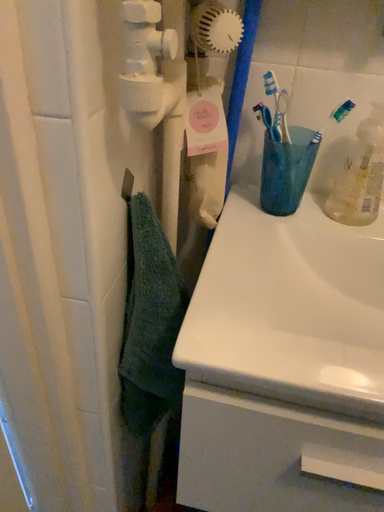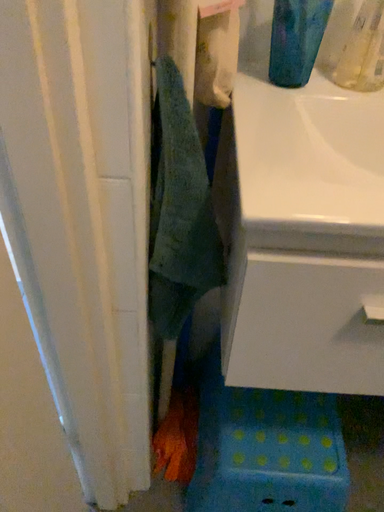
Question: How did the camera likely rotate when shooting the video?

Choices:
 (A) rotated upward
 (B) rotated downward

Answer: (B)